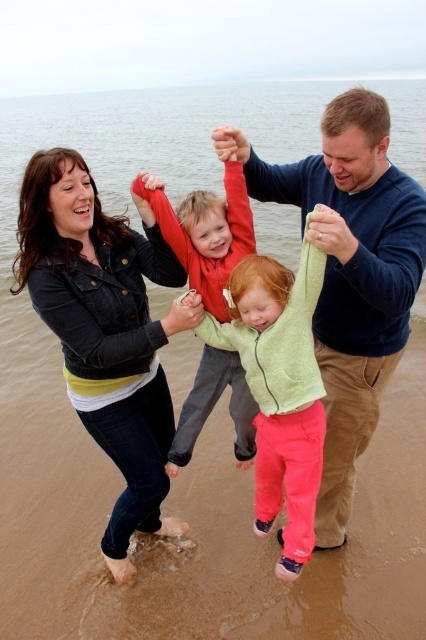
Does brown sandy beach at lower center come behind blue sweater at upper center?

Yes, it is behind blue sweater at upper center.

Is point (250, 516) more distant than point (342, 289)?

Yes, point (250, 516) is farther from viewer.

The image size is (426, 640). Identify the location of brown sandy beach at lower center. (207, 536).

I want to click on denim jacket at left, so click(106, 330).

Is denim jacket at left taller than red fleece sweater at center?

Yes.

Does point (164, 426) lie in front of point (187, 456)?

That is False.

Find the location of `denim jacket at left`. denim jacket at left is located at coordinates (106, 330).

In the scene shown: Can you confirm if denim jacket at left is shorter than light green fleece jacket at center?

In fact, denim jacket at left may be taller than light green fleece jacket at center.

Between denim jacket at left and light green fleece jacket at center, which one appears on the left side from the viewer's perspective?

Positioned to the left is denim jacket at left.

I want to click on denim jacket at left, so click(x=106, y=330).